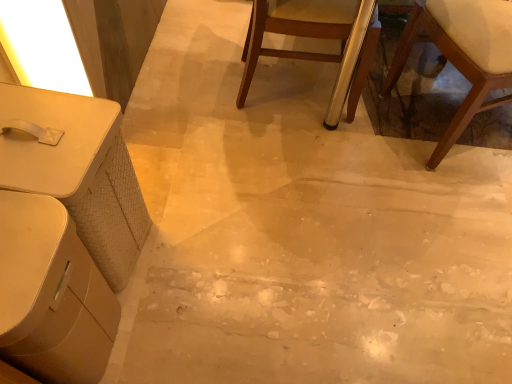
Find the location of a particular element. free location in front of wooden chair at center, marked as the 1th chair in a left-to-right arrangement is located at coordinates (256, 191).